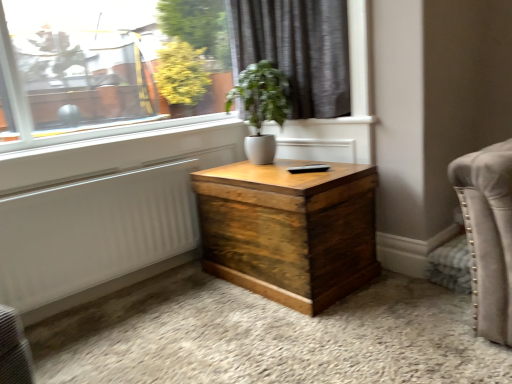
Based on the photo, what is the approximate width of white textured radiator at lower left?

white textured radiator at lower left is 8.89 centimeters in width.

What is the approximate width of rustic wood trunk at center?

rustic wood trunk at center is 23.41 inches wide.

The height and width of the screenshot is (384, 512). I want to click on rustic wood trunk at center, so (289, 230).

Image resolution: width=512 pixels, height=384 pixels. What are the coordinates of `dark grey fabric curtain at upper center` in the screenshot? It's located at pos(298,50).

From a real-world perspective, is white textured radiator at lower left physically above rustic wood trunk at center?

Yes.

Looking at this image, does white textured radiator at lower left appear on the right side of rustic wood trunk at center?

Incorrect, white textured radiator at lower left is not on the right side of rustic wood trunk at center.

The image size is (512, 384). In order to click on nightstand that is under the white textured radiator at lower left (from a real-world perspective) in this screenshot , I will do `click(289, 230)`.

How many degrees apart are the facing directions of white textured radiator at lower left and dark grey fabric curtain at upper center?

white textured radiator at lower left and dark grey fabric curtain at upper center are facing 89.9 degrees away from each other.

Could dark grey fabric curtain at upper center be considered to be inside white textured radiator at lower left?

No, dark grey fabric curtain at upper center is not a part of white textured radiator at lower left.

Based on the photo, can you confirm if white textured radiator at lower left is positioned to the left of dark grey fabric curtain at upper center?

Yes.

From the image's perspective, does white smooth window sill at upper center appear higher than rustic wood trunk at center?

Yes, from the image's perspective, white smooth window sill at upper center is over rustic wood trunk at center.

Between white smooth window sill at upper center and rustic wood trunk at center, which one has larger width?

rustic wood trunk at center is wider.

Is white smooth window sill at upper center looking in the opposite direction of rustic wood trunk at center?

That's not correct — white smooth window sill at upper center is not looking away from rustic wood trunk at center.

Who is smaller, white smooth window sill at upper center or rustic wood trunk at center?

Smaller between the two is white smooth window sill at upper center.

This screenshot has height=384, width=512. In order to click on radiator below the white smooth window sill at upper center (from a real-world perspective) in this screenshot , I will do `click(94, 237)`.

Could you tell me if white smooth window sill at upper center is turned towards white textured radiator at lower left?

No, white smooth window sill at upper center is not aimed at white textured radiator at lower left.

Does white smooth window sill at upper center have a greater height compared to white textured radiator at lower left?

Incorrect, the height of white smooth window sill at upper center is not larger of that of white textured radiator at lower left.

From the image's perspective, who appears lower, white smooth window sill at upper center or white textured radiator at lower left?

From the image's view, white textured radiator at lower left is below.

Find the location of `curtain above the rustic wood trunk at center (from a real-world perspective)`. curtain above the rustic wood trunk at center (from a real-world perspective) is located at coordinates (298, 50).

Which is closer, (346, 115) or (352, 243)?

The point (352, 243) is more forward.

Is dark grey fabric curtain at upper center further to camera compared to rustic wood trunk at center?

Yes, dark grey fabric curtain at upper center is behind rustic wood trunk at center.

Is dark grey fabric curtain at upper center turned away from rustic wood trunk at center?

No, dark grey fabric curtain at upper center is not facing away from rustic wood trunk at center.

From the image's perspective, between dark grey fabric curtain at upper center and white textured radiator at lower left, which one is located above?

dark grey fabric curtain at upper center appears higher in the image.

From a real-world perspective, which object stands above the other?

dark grey fabric curtain at upper center, from a real-world perspective.

In the scene shown: Which of these two, dark grey fabric curtain at upper center or white textured radiator at lower left, stands shorter?

Standing shorter between the two is white textured radiator at lower left.

Locate an element on the screen. houseplant to the right of white textured radiator at lower left is located at coordinates (261, 107).

Considering the sizes of objects white glossy vase at center and white textured radiator at lower left in the image provided, who is bigger, white glossy vase at center or white textured radiator at lower left?

white glossy vase at center.

Would you consider white glossy vase at center to be distant from white textured radiator at lower left?

That's not correct — white glossy vase at center is a little close to white textured radiator at lower left.

What's the angular difference between white glossy vase at center and white textured radiator at lower left's facing directions?

89.9 degrees.

The width and height of the screenshot is (512, 384). What are the coordinates of `nightstand that is above the white textured radiator at lower left (from the image's perspective)` in the screenshot? It's located at (289, 230).

Find the location of a particular element. The height and width of the screenshot is (384, 512). radiator on the left of the dark grey fabric curtain at upper center is located at coordinates (94, 237).

Consider the image. When comparing their distances from dark grey fabric curtain at upper center, does white smooth window sill at upper center or rustic wood trunk at center seem closer?

white smooth window sill at upper center lies closer to dark grey fabric curtain at upper center than the other object.

From the image, which object appears to be farther from white glossy vase at center, dark grey fabric curtain at upper center or rustic wood trunk at center?

rustic wood trunk at center is positioned further to the anchor white glossy vase at center.

Looking at the image, which one is located further to rustic wood trunk at center, white smooth window sill at upper center or white textured radiator at lower left?

Among the two, white smooth window sill at upper center is located further to rustic wood trunk at center.

From the image, which object appears to be nearer to white textured radiator at lower left, white smooth window sill at upper center or white glossy vase at center?

The object closer to white textured radiator at lower left is white smooth window sill at upper center.

Based on the photo, looking at the image, which one is located further to white textured radiator at lower left, rustic wood trunk at center or white glossy vase at center?

white glossy vase at center.

Considering their positions, is white textured radiator at lower left positioned closer to white smooth window sill at upper center than rustic wood trunk at center?

white textured radiator at lower left.

From the picture: Estimate the real-world distances between objects in this image. Which object is further from white smooth window sill at upper center, white glossy vase at center or rustic wood trunk at center?

rustic wood trunk at center is further to white smooth window sill at upper center.

Looking at the image, which one is located further to dark grey fabric curtain at upper center, rustic wood trunk at center or white textured radiator at lower left?

Among the two, white textured radiator at lower left is located further to dark grey fabric curtain at upper center.

The height and width of the screenshot is (384, 512). Identify the location of window sill located between white textured radiator at lower left and rustic wood trunk at center in the left-right direction. (110, 135).

Image resolution: width=512 pixels, height=384 pixels. Find the location of `houseplant between white smooth window sill at upper center and dark grey fabric curtain at upper center in the horizontal direction`. houseplant between white smooth window sill at upper center and dark grey fabric curtain at upper center in the horizontal direction is located at coordinates (261, 107).

Locate an element on the screen. window sill between dark grey fabric curtain at upper center and rustic wood trunk at center in the vertical direction is located at coordinates (110, 135).

At what (x,y) coordinates should I click in order to perform the action: click on houseplant between dark grey fabric curtain at upper center and white textured radiator at lower left in the vertical direction. Please return your answer as a coordinate pair (x, y). The width and height of the screenshot is (512, 384). Looking at the image, I should click on (261, 107).